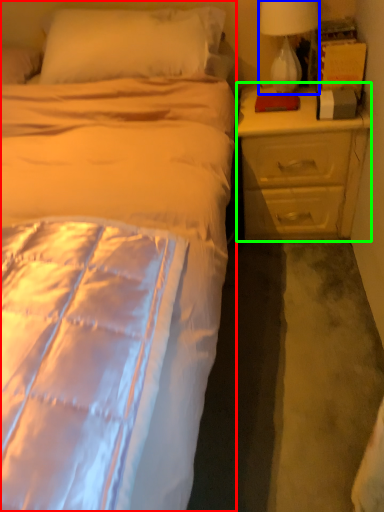
Question: Considering the real-world distances, which object is farthest from bed (highlighted by a red box)? lamp (highlighted by a blue box) or nightstand (highlighted by a green box)?

Choices:
 (A) lamp
 (B) nightstand

Answer: (A)